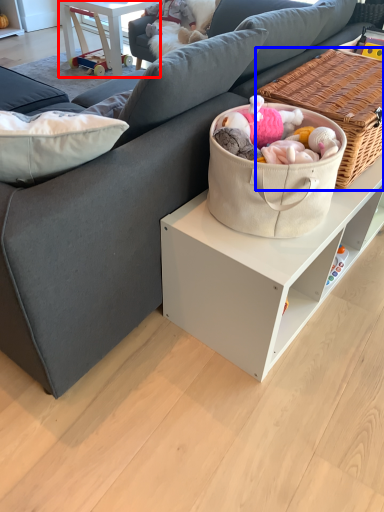
Question: Which of the following is the closest to the observer, table (highlighted by a red box) or picnic basket (highlighted by a blue box)?

Choices:
 (A) table
 (B) picnic basket

Answer: (B)